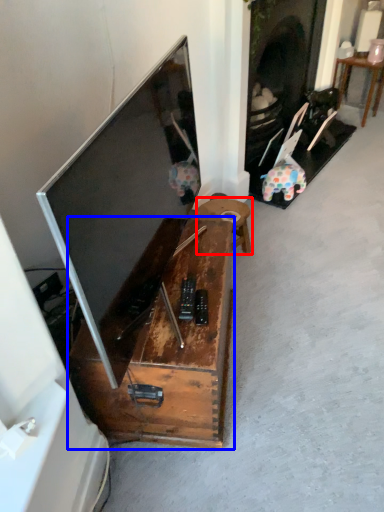
Question: Among these objects, which one is farthest to the camera, table (highlighted by a red box) or furniture (highlighted by a blue box)?

Choices:
 (A) table
 (B) furniture

Answer: (A)